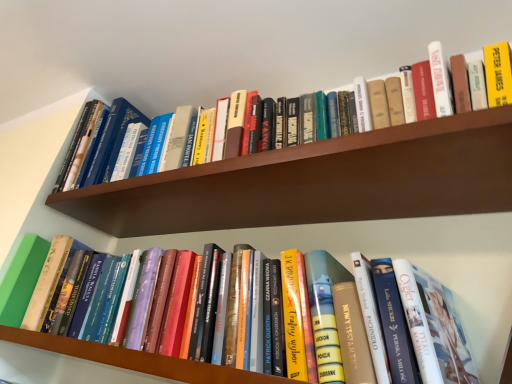
Question: Is the depth of hardcover book at upper center, which is counted as the first book, starting from the top, less than that of hardcover book at center, the 2th book when ordered from top to bottom?

Choices:
 (A) yes
 (B) no

Answer: (B)

Question: Is hardcover book at upper center, the second book in the bottom-to-top sequence, at the right side of hardcover book at center, the first book ordered from the bottom?

Choices:
 (A) no
 (B) yes

Answer: (A)

Question: Considering the relative sizes of hardcover book at upper center, the second book in the bottom-to-top sequence, and hardcover book at center, the first book ordered from the bottom, in the image provided, is hardcover book at upper center, the second book in the bottom-to-top sequence, taller than hardcover book at center, the first book ordered from the bottom,?

Choices:
 (A) no
 (B) yes

Answer: (A)

Question: Does hardcover book at upper center, the second book in the bottom-to-top sequence, have a lesser width compared to hardcover book at center, the first book ordered from the bottom?

Choices:
 (A) no
 (B) yes

Answer: (A)

Question: Could you tell me if hardcover book at upper center, which is counted as the first book, starting from the top, is facing hardcover book at center, the 2th book when ordered from top to bottom?

Choices:
 (A) yes
 (B) no

Answer: (B)

Question: Looking at their shapes, would you say hardcover book at center, the 2th book when ordered from top to bottom, is wider or thinner than wooden bookshelf at upper center, positioned as the 1th shelf in top-to-bottom order?

Choices:
 (A) wide
 (B) thin

Answer: (B)

Question: From the image's perspective, relative to wooden bookshelf at upper center, positioned as the 1th shelf in top-to-bottom order, is hardcover book at center, the 2th book when ordered from top to bottom, above or below?

Choices:
 (A) above
 (B) below

Answer: (B)

Question: From a real-world perspective, is hardcover book at center, the 2th book when ordered from top to bottom, positioned above or below wooden bookshelf at upper center, the 2th shelf in the bottom-to-top sequence?

Choices:
 (A) below
 (B) above

Answer: (A)

Question: Considering the positions of hardcover book at center, the 2th book when ordered from top to bottom, and wooden bookshelf at upper center, positioned as the 1th shelf in top-to-bottom order, in the image, is hardcover book at center, the 2th book when ordered from top to bottom, bigger or smaller than wooden bookshelf at upper center, positioned as the 1th shelf in top-to-bottom order,?

Choices:
 (A) big
 (B) small

Answer: (A)

Question: Does point (201, 370) appear closer or farther from the camera than point (92, 344)?

Choices:
 (A) farther
 (B) closer

Answer: (B)

Question: Choose the correct answer: Is hardcover book at center, the 2th book when ordered from top to bottom, inside hardcover books at center, placed as the first shelf when sorted from bottom to top, or outside it?

Choices:
 (A) outside
 (B) inside

Answer: (A)

Question: From a real-world perspective, is hardcover book at center, the first book ordered from the bottom, physically located above or below hardcover books at center, placed as the first shelf when sorted from bottom to top?

Choices:
 (A) above
 (B) below

Answer: (A)

Question: From the image's perspective, is hardcover book at center, the first book ordered from the bottom, above or below hardcover books at center, placed as the first shelf when sorted from bottom to top?

Choices:
 (A) above
 (B) below

Answer: (A)

Question: From the image's perspective, is hardcover book at upper center, which is counted as the first book, starting from the top, positioned above or below wooden bookshelf at upper center, the 2th shelf in the bottom-to-top sequence?

Choices:
 (A) above
 (B) below

Answer: (A)

Question: Is hardcover book at upper center, the second book in the bottom-to-top sequence, to the left or to the right of wooden bookshelf at upper center, positioned as the 1th shelf in top-to-bottom order, in the image?

Choices:
 (A) left
 (B) right

Answer: (A)